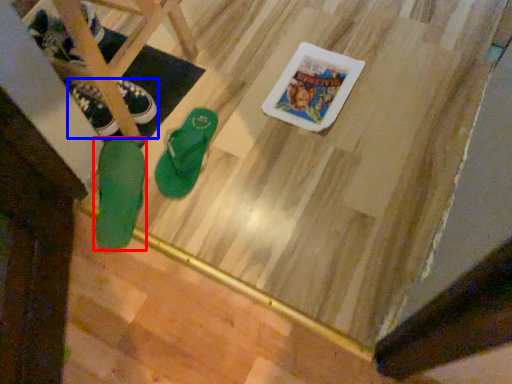
Question: Which object appears farthest to the camera in this image, footwear (highlighted by a red box) or footwear (highlighted by a blue box)?

Choices:
 (A) footwear
 (B) footwear

Answer: (B)